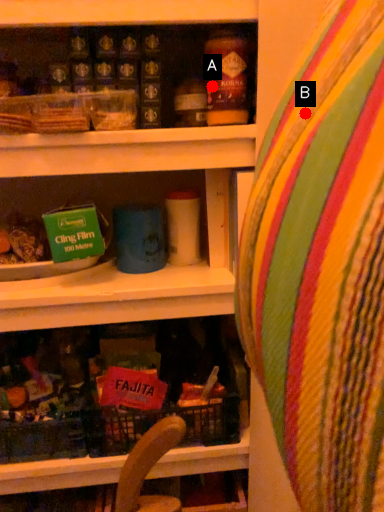
Question: Two points are circled on the image, labeled by A and B beside each circle. Among these points, which one is farthest from the camera?

Choices:
 (A) A is further
 (B) B is further

Answer: (A)